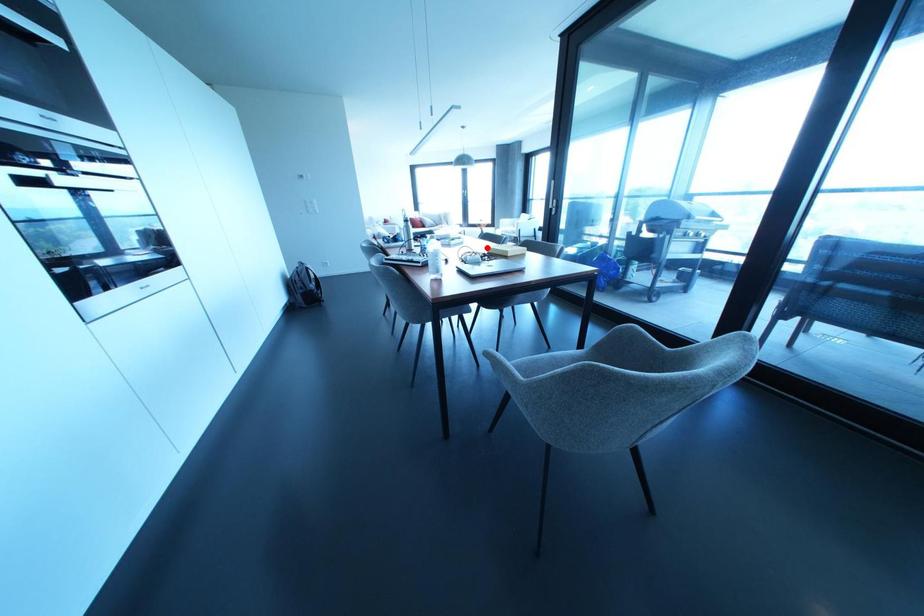
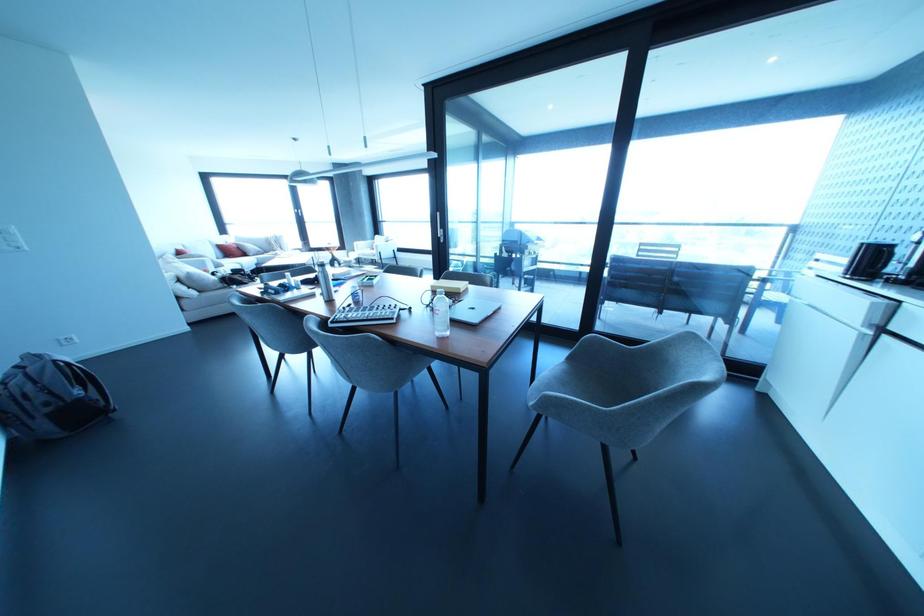
In the second image, find the point that corresponds to the highlighted location in the first image.

(431, 286)